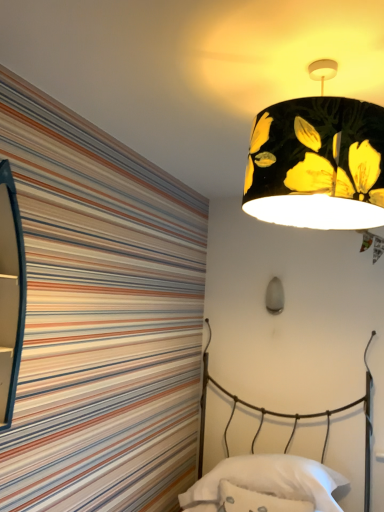
Question: Can you confirm if white soft pillow at lower center is taller than metallic wire bed at lower right?

Choices:
 (A) no
 (B) yes

Answer: (A)

Question: From the image's perspective, would you say white soft pillow at lower center is positioned over metallic wire bed at lower right?

Choices:
 (A) no
 (B) yes

Answer: (A)

Question: Are white soft pillow at lower center and metallic wire bed at lower right far apart?

Choices:
 (A) no
 (B) yes

Answer: (A)

Question: Is white soft pillow at lower center oriented towards metallic wire bed at lower right?

Choices:
 (A) yes
 (B) no

Answer: (A)

Question: From a real-world perspective, is white soft pillow at lower center below metallic wire bed at lower right?

Choices:
 (A) yes
 (B) no

Answer: (A)

Question: Does point (264, 300) appear closer or farther from the camera than point (324, 138)?

Choices:
 (A) closer
 (B) farther

Answer: (B)

Question: In the image, is matte gray bulb at center, acting as the first lamp starting from the back, on the left side or the right side of black fabric lampshade at upper right, placed as the second lamp when sorted from back to front?

Choices:
 (A) left
 (B) right

Answer: (B)

Question: From a real-world perspective, is matte gray bulb at center, which is the 1th lamp from bottom to top, physically located above or below black fabric lampshade at upper right, placed as the second lamp when sorted from back to front?

Choices:
 (A) above
 (B) below

Answer: (B)

Question: Considering their positions, is matte gray bulb at center, the second lamp positioned from the top, located in front of or behind black fabric lampshade at upper right, placed as the second lamp when sorted from back to front?

Choices:
 (A) behind
 (B) front

Answer: (A)

Question: Based on their positions, is white fluffy throw pillow at lower center located to the left or right of metallic wire bed at lower right?

Choices:
 (A) left
 (B) right

Answer: (B)

Question: From their relative heights in the image, would you say white fluffy throw pillow at lower center is taller or shorter than metallic wire bed at lower right?

Choices:
 (A) short
 (B) tall

Answer: (A)

Question: From a real-world perspective, is white fluffy throw pillow at lower center above or below metallic wire bed at lower right?

Choices:
 (A) above
 (B) below

Answer: (B)

Question: Relative to metallic wire bed at lower right, is white fluffy throw pillow at lower center in front or behind?

Choices:
 (A) behind
 (B) front

Answer: (A)

Question: Considering the positions of white soft pillow at lower center and black fabric lampshade at upper right, the first lamp from the top, in the image, is white soft pillow at lower center taller or shorter than black fabric lampshade at upper right, the first lamp from the top,?

Choices:
 (A) short
 (B) tall

Answer: (A)

Question: Is white soft pillow at lower center inside the boundaries of black fabric lampshade at upper right, the 2th lamp in the bottom-to-top sequence, or outside?

Choices:
 (A) outside
 (B) inside

Answer: (A)